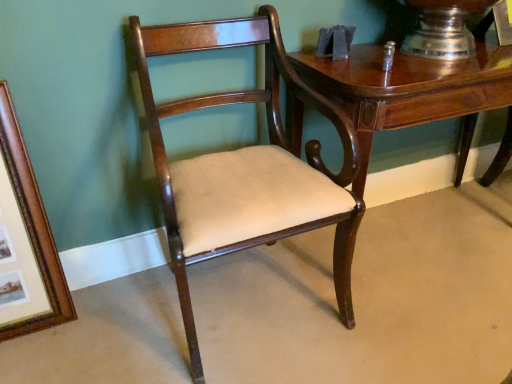
In order to click on free space that is in between mahogany wood chair at center and glossy wood table at upper right in this screenshot , I will do `click(420, 286)`.